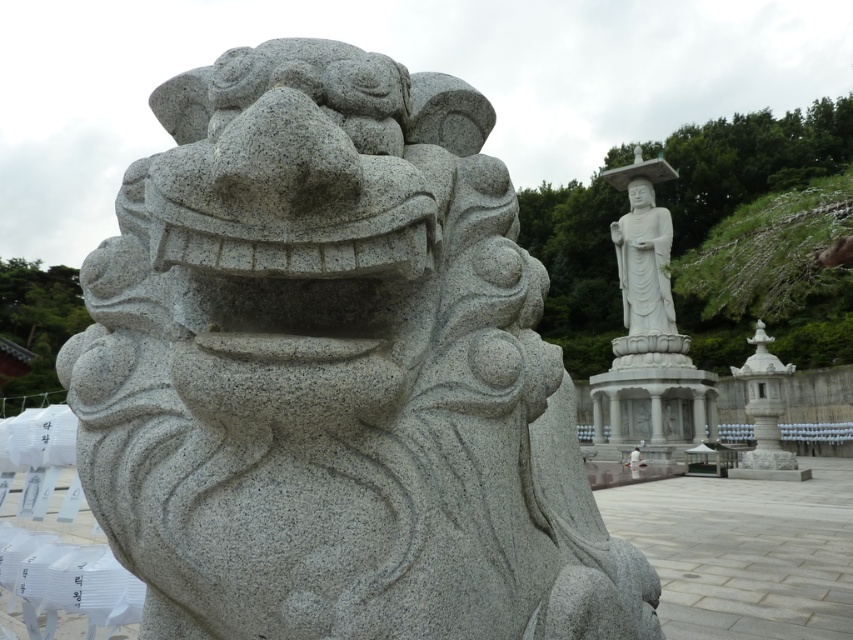
Does granite statue at center have a lesser height compared to white stone statue at upper center?

Incorrect, granite statue at center's height does not fall short of white stone statue at upper center's.

Is point (418, 634) less distant than point (653, 276)?

Yes, it is.

Which is in front, point (445, 160) or point (619, 172)?

Point (445, 160) is in front.

In order to click on granite statue at center in this screenshot , I will do `click(335, 371)`.